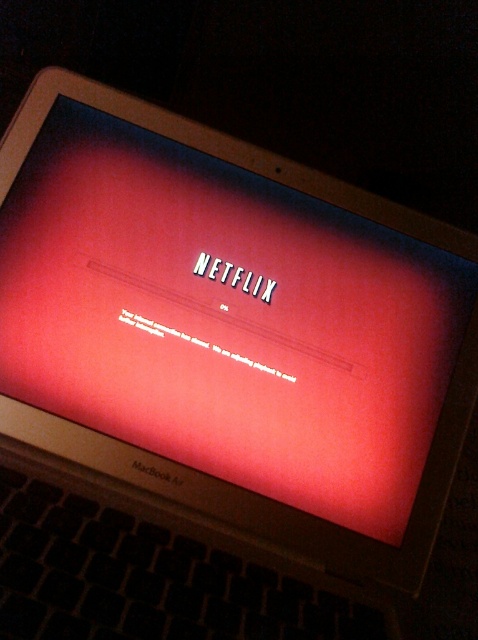
Between matte plastic computer screen at center and matte plastic netflix logo at center, which one appears on the left side from the viewer's perspective?

matte plastic computer screen at center is more to the left.

Can you confirm if matte plastic computer screen at center is positioned below matte plastic netflix logo at center?

Yes, matte plastic computer screen at center is below matte plastic netflix logo at center.

Which is in front, point (32, 337) or point (229, 284)?

Point (32, 337) is in front.

Where is `matte plastic computer screen at center`? The width and height of the screenshot is (478, 640). matte plastic computer screen at center is located at coordinates (228, 314).